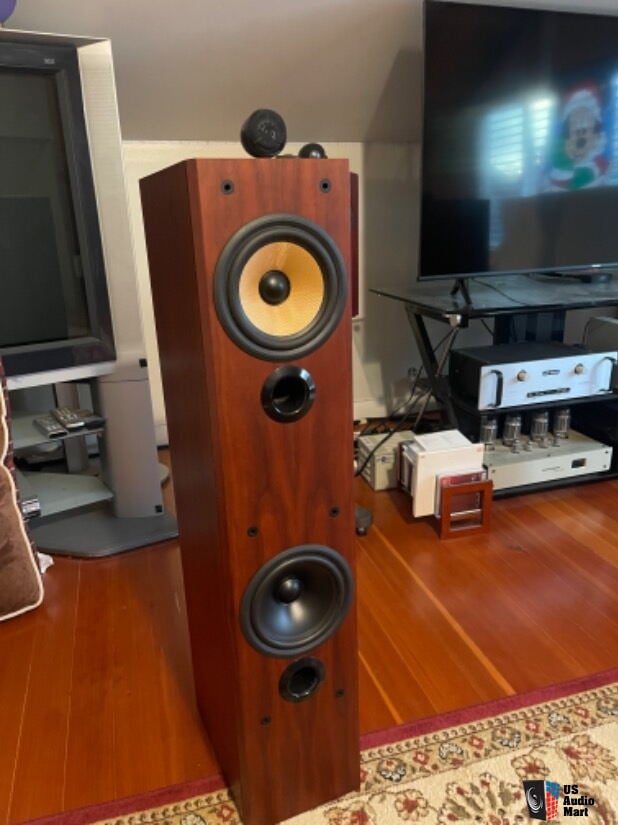
The image size is (618, 825). Identify the location of tv stand. (133, 403), (551, 291).